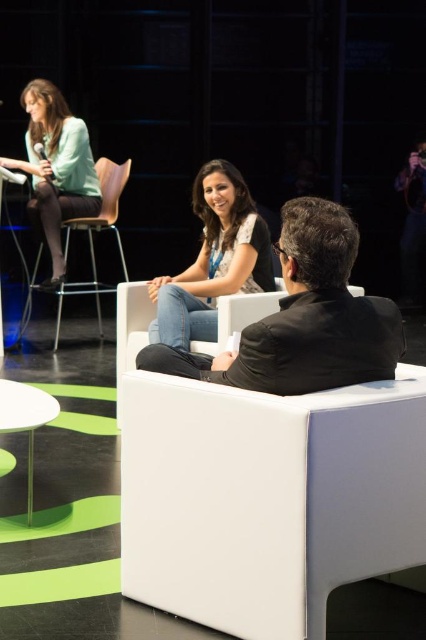
Question: Estimate the real-world distances between objects in this image. Which object is farther from the metallic silver stool at upper left?

Choices:
 (A) white glossy table at lower left
 (B) matte green shirt at upper left
 (C) jeans at center

Answer: (A)

Question: Is metallic silver stool at upper left to the left of white leather chair at center from the viewer's perspective?

Choices:
 (A) yes
 (B) no

Answer: (A)

Question: Does matte green shirt at upper left have a larger size compared to white glossy table at lower left?

Choices:
 (A) yes
 (B) no

Answer: (A)

Question: Observing the image, what is the correct spatial positioning of metallic silver stool at upper left in reference to white glossy table at lower left?

Choices:
 (A) above
 (B) below

Answer: (A)

Question: Which of the following is the closest to the observer?

Choices:
 (A) white glossy table at lower left
 (B) black matte suit at center
 (C) metallic silver stool at upper left
 (D) jeans at center

Answer: (B)

Question: Which object is positioned farthest from the metallic silver stool at upper left?

Choices:
 (A) matte green shirt at upper left
 (B) white leather chair at center

Answer: (B)